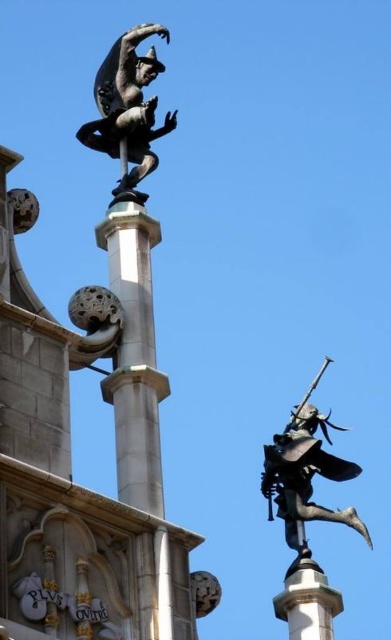
You are an architect designing a new plaza and want to place a new statue exactly 0.1 meters to the right of the polished bronze figure at upper left. What coordinate should you use for the new statue?

The new statue should be placed at coordinate x 0.172 plus 0.1 equals 0.272, y remains 0.327. So the coordinate is (x=127, y=173).

You are an art student analyzing the statues in the image. You notice both the polished bronze figure at upper left and the polished bronze figure at upper right. Which of these two statues is positioned further to the east? Please provide your reasoning based on their spatial relationship in the scene.

The polished bronze figure at upper left is positioned to the left of the polished bronze figure at upper right. Since the image is viewed from a standard perspective where left corresponds to west and right to east, the polished bronze figure at upper right is further to the east.